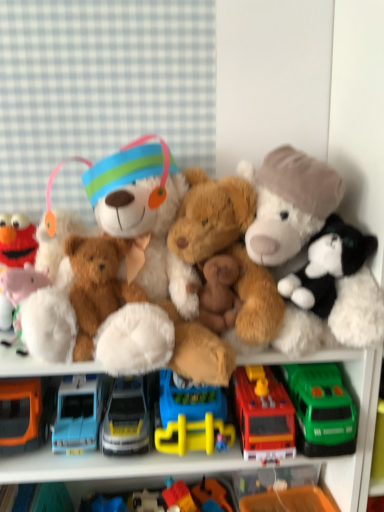
Question: Can you confirm if fluffy white stuffed animal at right, the 2th toy in the right-to-left sequence, is smaller than white plush pig at left, placed as the 9th toy when sorted from right to left?

Choices:
 (A) no
 (B) yes

Answer: (A)

Question: Can white plush pig at left, placed as the 9th toy when sorted from right to left, be found inside fluffy white stuffed animal at right, which is the 8th toy from left to right?

Choices:
 (A) yes
 (B) no

Answer: (B)

Question: Can you confirm if fluffy white stuffed animal at right, which is the 8th toy from left to right, is shorter than white plush pig at left, placed as the 9th toy when sorted from right to left?

Choices:
 (A) no
 (B) yes

Answer: (A)

Question: Is fluffy white stuffed animal at right, which is the 8th toy from left to right, to the right of white plush pig at left, placed as the 9th toy when sorted from right to left, from the viewer's perspective?

Choices:
 (A) yes
 (B) no

Answer: (A)

Question: Is fluffy white stuffed animal at right, the 2th toy in the right-to-left sequence, taller than white plush pig at left, placed as the 1th toy when sorted from left to right?

Choices:
 (A) no
 (B) yes

Answer: (B)

Question: Does fluffy white stuffed animal at right, which is the 8th toy from left to right, have a larger size compared to white plush pig at left, placed as the 1th toy when sorted from left to right?

Choices:
 (A) no
 (B) yes

Answer: (B)

Question: Is rubber duck at center, marked as the 6th toy in a left-to-right arrangement, not close to fluffy white stuffed animal at right, the 2th toy in the right-to-left sequence?

Choices:
 (A) no
 (B) yes

Answer: (A)

Question: Is rubber duck at center, marked as the 6th toy in a left-to-right arrangement, surrounding fluffy white stuffed animal at right, the 2th toy in the right-to-left sequence?

Choices:
 (A) yes
 (B) no

Answer: (B)

Question: Is rubber duck at center, the fourth toy viewed from the right, bigger than fluffy white stuffed animal at right, the 2th toy in the right-to-left sequence?

Choices:
 (A) no
 (B) yes

Answer: (A)

Question: Is rubber duck at center, marked as the 6th toy in a left-to-right arrangement, positioned with its back to fluffy white stuffed animal at right, the 2th toy in the right-to-left sequence?

Choices:
 (A) no
 (B) yes

Answer: (A)

Question: Is rubber duck at center, marked as the 6th toy in a left-to-right arrangement, further to camera compared to fluffy white stuffed animal at right, the 2th toy in the right-to-left sequence?

Choices:
 (A) yes
 (B) no

Answer: (A)

Question: Can we say rubber duck at center, marked as the 6th toy in a left-to-right arrangement, lies outside fluffy white stuffed animal at right, the 2th toy in the right-to-left sequence?

Choices:
 (A) no
 (B) yes

Answer: (B)

Question: Does blue plastic toy truck at center, placed as the 3th truck when sorted from left to right, have a larger size compared to black plush cat at right, marked as the first toy in a right-to-left arrangement?

Choices:
 (A) yes
 (B) no

Answer: (A)